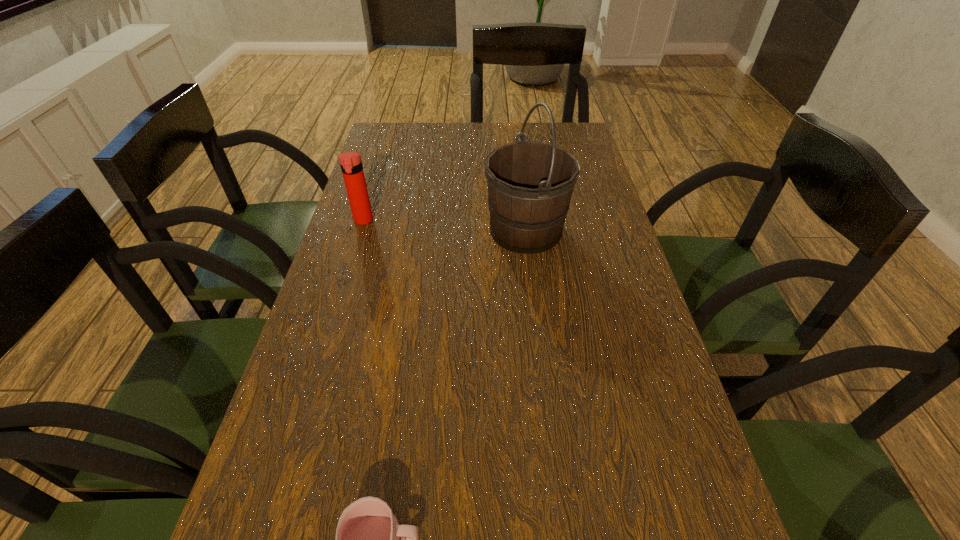
This screenshot has width=960, height=540. In order to click on the rightmost object in this screenshot , I will do `click(530, 184)`.

You are a GUI agent. You are given a task and a screenshot of the screen. Output one action in this format:
    pyautogui.click(x=<x>, y=<y>)
    Task: Click on the bucket
    This screenshot has width=960, height=540.
    Given the screenshot: What is the action you would take?
    pyautogui.click(x=530, y=184)

Identify the location of the leftmost object. The width and height of the screenshot is (960, 540). (351, 165).

Where is `thermos bottle`? thermos bottle is located at coordinates (351, 165).

Identify the location of vacant point located 0.180m on the back of the rightmost object. (518, 171).

What are the coordinates of `vacant space located on the right of the leftmost object` in the screenshot? It's located at (511, 220).

At what (x,y) coordinates should I click in order to perform the action: click on object located in the left edge section of the desktop. Please return your answer as a coordinate pair (x, y). Looking at the image, I should click on (351, 165).

I want to click on object present at the right edge, so click(x=530, y=184).

Locate an element on the screen. The height and width of the screenshot is (540, 960). vacant space at the far edge is located at coordinates (433, 138).

You are a GUI agent. You are given a task and a screenshot of the screen. Output one action in this format:
    pyautogui.click(x=<x>, y=<y>)
    Task: Click on the vacant area at the left edge of the desktop
    
    Given the screenshot: What is the action you would take?
    pyautogui.click(x=339, y=445)